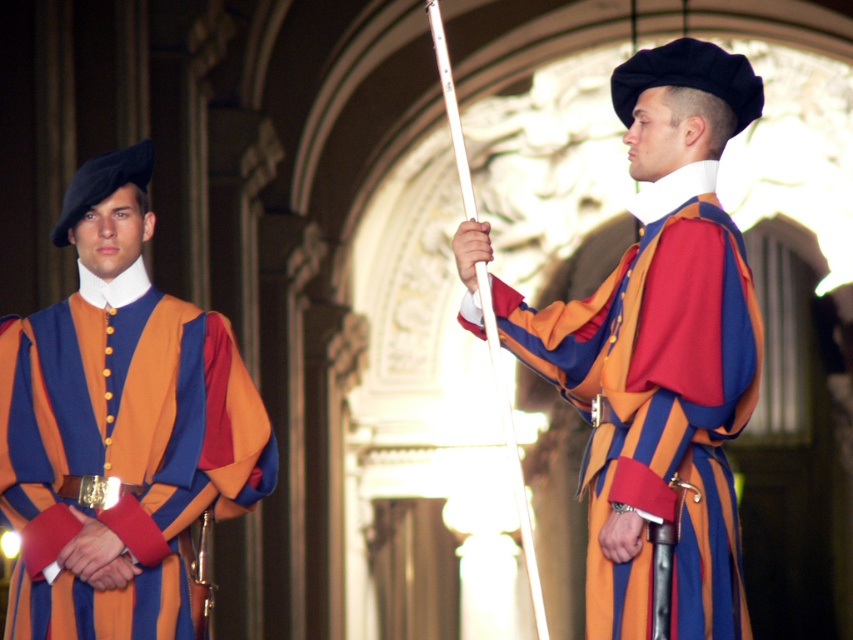
Between point (759, 362) and point (234, 355), which one is positioned behind?

The point (234, 355) is more distant.

Between matte orange and blue striped tunic at center and matte orange vest at center, which one is positioned lower?

matte orange vest at center is below.

Measure the distance between point [642,154] and camera.

A distance of 61.01 meters exists between point [642,154] and camera.

The image size is (853, 640). Identify the location of matte orange and blue striped tunic at center. (660, 353).